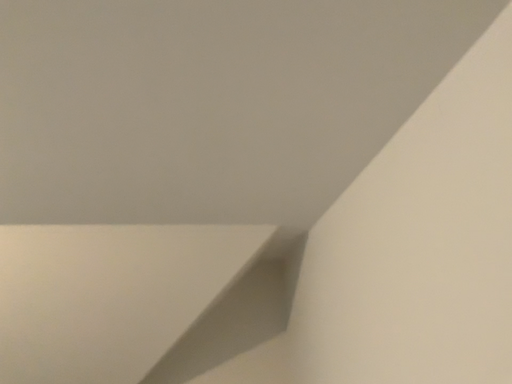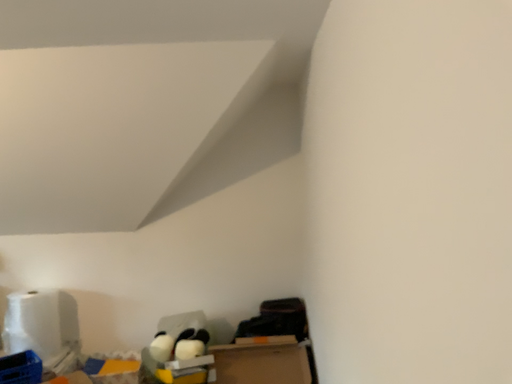
Question: How did the camera likely rotate when shooting the video?

Choices:
 (A) rotated upward
 (B) rotated downward

Answer: (B)